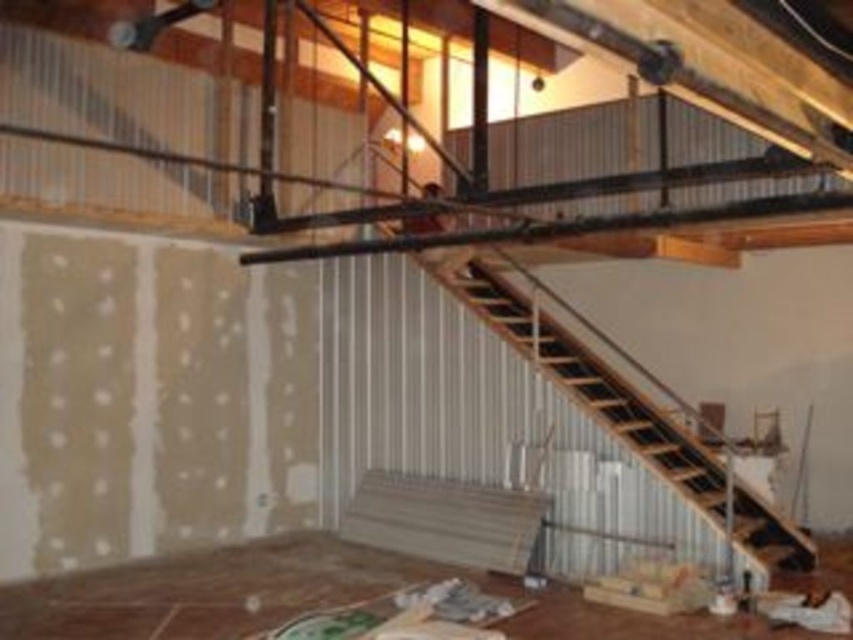
Who is taller, wooden floor at lower left or wooden stairs at center?

wooden stairs at center is taller.

Does point (352, 579) come in front of point (577, 353)?

Yes, it is in front of point (577, 353).

This screenshot has height=640, width=853. Identify the location of wooden floor at lower left. (308, 596).